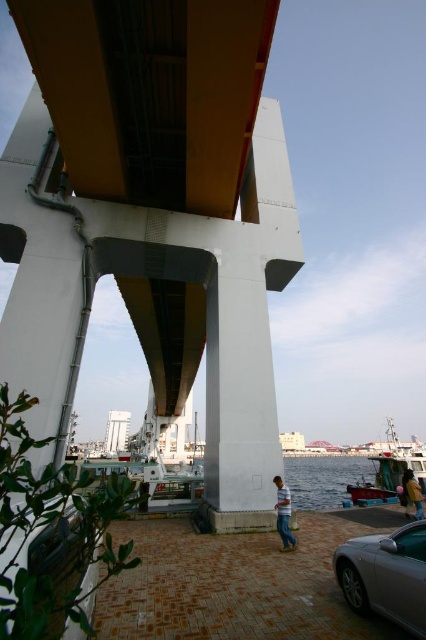
Between striped cotton shirt at lower center and dark yellow jacket at lower right, which one appears on the right side from the viewer's perspective?

dark yellow jacket at lower right

Is point (290, 512) farther from camera compared to point (416, 518)?

No.

Locate an element on the screen. The image size is (426, 640). striped cotton shirt at lower center is located at coordinates (284, 513).

Can you confirm if silver metallic car at lower right is wider than dark yellow jacket at lower right?

Incorrect, silver metallic car at lower right's width does not surpass dark yellow jacket at lower right's.

Locate an element on the screen. This screenshot has height=640, width=426. silver metallic car at lower right is located at coordinates (385, 576).

Is white smooth concrete pillar at center shorter than striped cotton shirt at lower center?

No.

Identify the location of white smooth concrete pillar at center. Image resolution: width=426 pixels, height=640 pixels. (238, 401).

Where is `white smooth concrete pillar at center`? This screenshot has width=426, height=640. white smooth concrete pillar at center is located at coordinates (238, 401).